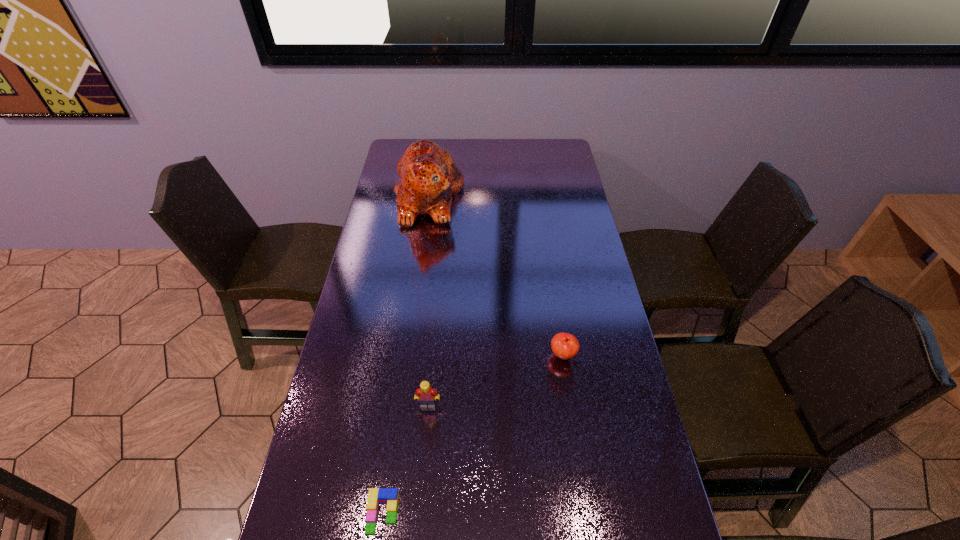
Locate an element on the screen. vacant space located on the left of the apple is located at coordinates (497, 355).

Where is `vacant position located 0.330m on the right of the shorter Lego`? This screenshot has width=960, height=540. vacant position located 0.330m on the right of the shorter Lego is located at coordinates (544, 514).

Find the location of a particular element. object at the left edge is located at coordinates (429, 179).

At what (x,y) coordinates should I click in order to perform the action: click on object that is at the right edge. Please return your answer as a coordinate pair (x, y). Image resolution: width=960 pixels, height=540 pixels. Looking at the image, I should click on (565, 346).

In the image, there is a desktop. Where is `blank space at the far edge`? blank space at the far edge is located at coordinates (493, 158).

Identify the location of free point at the left edge. (313, 523).

Locate an element on the screen. Image resolution: width=960 pixels, height=540 pixels. free spot at the right edge of the desktop is located at coordinates (624, 497).

This screenshot has height=540, width=960. In the image, there is a desktop. What are the coordinates of `vacant region at the far right corner` in the screenshot? It's located at (560, 146).

You are a GUI agent. You are given a task and a screenshot of the screen. Output one action in this format:
    pyautogui.click(x=<x>, y=<y>)
    Task: Click on the empty location between the left Lego and the farthest object
    
    Given the screenshot: What is the action you would take?
    pyautogui.click(x=406, y=356)

Find the location of a particular element. The width and height of the screenshot is (960, 540). unoccupied position between the shorter Lego and the tallest object is located at coordinates (406, 356).